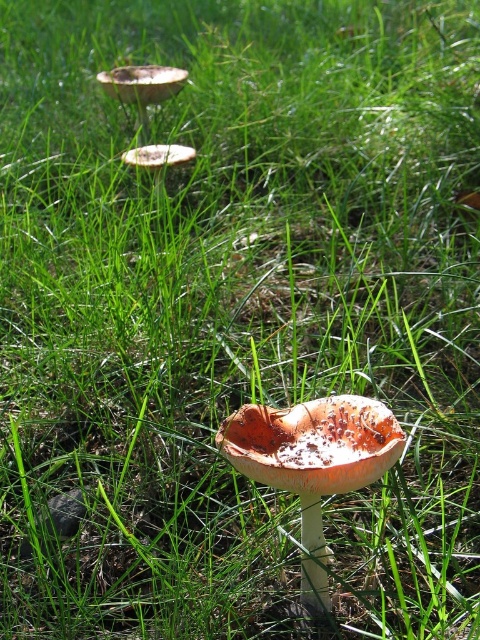
Question: Which point appears farthest from the camera in this image?

Choices:
 (A) (168, 152)
 (B) (178, 70)

Answer: (B)

Question: Which point is farther from the camera taking this photo?

Choices:
 (A) (124, 90)
 (B) (310, 410)

Answer: (A)

Question: Can you confirm if orange matte mushroom at center is positioned below white matte mushroom at upper left?

Choices:
 (A) no
 (B) yes

Answer: (B)

Question: Observing the image, what is the correct spatial positioning of orange matte mushroom at center in reference to orange-brown cap at upper center?

Choices:
 (A) above
 (B) below

Answer: (B)

Question: Which object is farther from the camera taking this photo?

Choices:
 (A) orange-brown cap at upper center
 (B) white matte mushroom at upper left

Answer: (A)

Question: Is orange matte mushroom at center positioned in front of white matte mushroom at upper left?

Choices:
 (A) yes
 (B) no

Answer: (A)